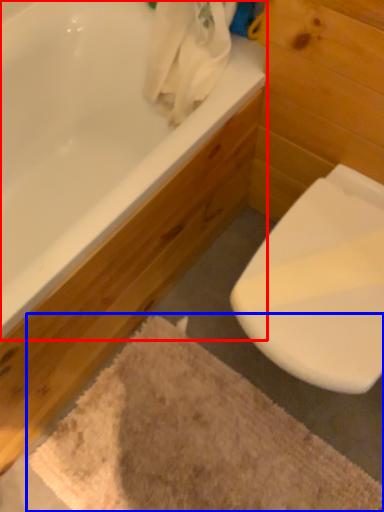
Question: Which point is further to the camera, bathtub (highlighted by a red box) or bath mat (highlighted by a blue box)?

Choices:
 (A) bathtub
 (B) bath mat

Answer: (B)